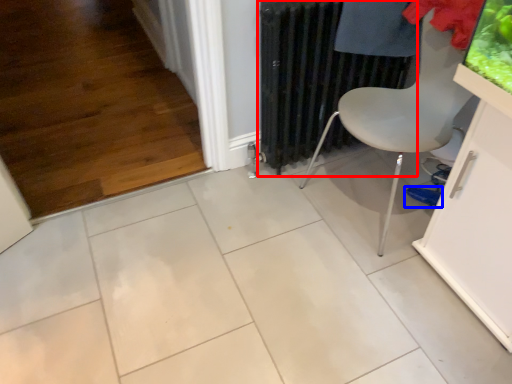
Question: Which of the following is the closest to the observer, radiator (highlighted by a red box) or footwear (highlighted by a blue box)?

Choices:
 (A) radiator
 (B) footwear

Answer: (A)